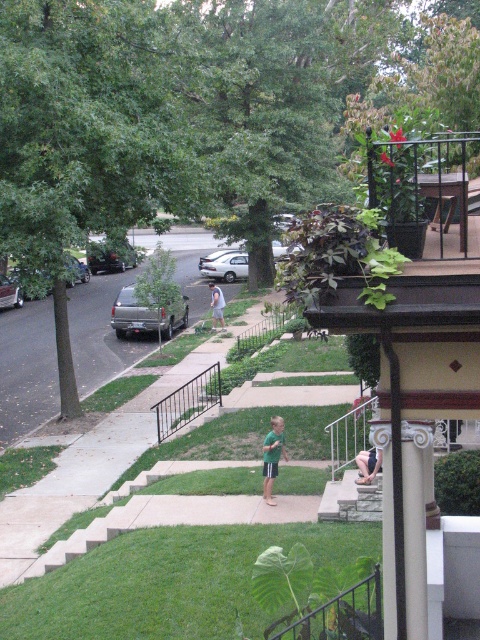
You are standing on the sidewalk and want to cross the street to reach the park on the other side. There are two vehicles parked at the left side of the street. Which vehicle, the silver metallic truck at left or the shiny silver suv at left, is closer to you as you stand on the sidewalk?

The silver metallic truck at left is closer to you because the shiny silver suv at left is behind it, meaning the truck is in front and nearer to your position on the sidewalk.

You are standing on the balcony looking down at the suburban scene. You notice the black metal rail at lower center. Can you determine its exact position using the coordinate system provided?

The black metal rail at lower center is located at point coordinates (188, 401).

You are standing on the balcony looking down at the suburban scene. You see a white matte sedan at center and a white cotton shirt at center. Which object appears larger in the image?

The white cotton shirt at center appears larger than the white matte sedan at center in the image.